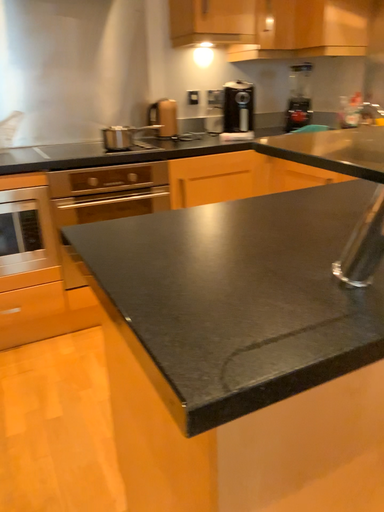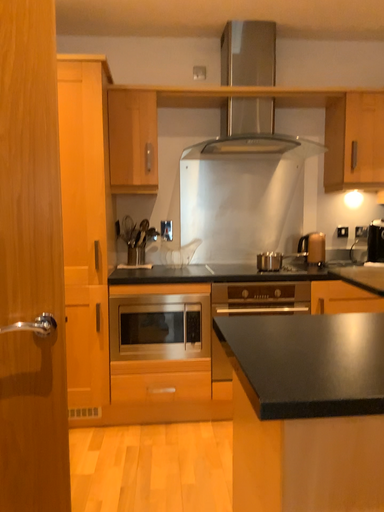
Question: How did the camera likely rotate when shooting the video?

Choices:
 (A) rotated left
 (B) rotated right

Answer: (A)